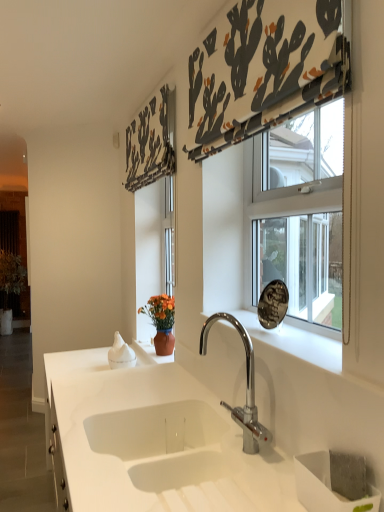
Measure the distance between white marble window sill at center and camera.

1.01 meters.

This screenshot has width=384, height=512. I want to click on white marble window sill at center, so click(296, 341).

Measure the distance between white matte sink at center and camera.

white matte sink at center is 38.37 inches away from camera.

Identify the location of white fabric with cactus print at upper center, which is the first curtain in right-to-left order. (263, 69).

The image size is (384, 512). I want to click on chrome metallic faucet at center, so click(x=246, y=387).

How much distance is there between black fabric with cactus print at upper center, arranged as the second curtain when viewed from the front, and chrome metallic faucet at center?

black fabric with cactus print at upper center, arranged as the second curtain when viewed from the front, and chrome metallic faucet at center are 3.62 feet apart from each other.

Looking at this image, is black fabric with cactus print at upper center, which ranks as the first curtain in left-to-right order, inside the boundaries of chrome metallic faucet at center, or outside?

black fabric with cactus print at upper center, which ranks as the first curtain in left-to-right order, cannot be found inside chrome metallic faucet at center.

Find the location of a particular element. tap that appears below the black fabric with cactus print at upper center, arranged as the 1th curtain when viewed from the back (from the image's perspective) is located at coordinates (246, 387).

Is black fabric with cactus print at upper center, arranged as the second curtain when viewed from the front, aimed at chrome metallic faucet at center?

No.

Is black fabric with cactus print at upper center, the second curtain viewed from the right, positioned far away from white fabric with cactus print at upper center, the first curtain when ordered from front to back?

No, black fabric with cactus print at upper center, the second curtain viewed from the right, is not far away from white fabric with cactus print at upper center, the first curtain when ordered from front to back.

Looking at this image, is black fabric with cactus print at upper center, arranged as the second curtain when viewed from the front, looking in the opposite direction of white fabric with cactus print at upper center, which is the first curtain in right-to-left order?

No, white fabric with cactus print at upper center, which is the first curtain in right-to-left order, is not at the back of black fabric with cactus print at upper center, arranged as the second curtain when viewed from the front.

Locate an element on the screen. curtain above the black fabric with cactus print at upper center, which ranks as the first curtain in left-to-right order (from a real-world perspective) is located at coordinates (263, 69).

Is white fabric with cactus print at upper center, the second curtain in the left-to-right sequence, inside black fabric with cactus print at upper center, the second curtain viewed from the right?

Definitely not — white fabric with cactus print at upper center, the second curtain in the left-to-right sequence, is not inside black fabric with cactus print at upper center, the second curtain viewed from the right.

Which object is more forward, white fabric with cactus print at upper center, which is counted as the 2th curtain, starting from the back, or black fabric with cactus print at upper center, which ranks as the first curtain in left-to-right order?

white fabric with cactus print at upper center, which is counted as the 2th curtain, starting from the back, is closer to the camera.

Visually, is white fabric with cactus print at upper center, the first curtain when ordered from front to back, positioned to the left or to the right of black fabric with cactus print at upper center, which ranks as the first curtain in left-to-right order?

white fabric with cactus print at upper center, the first curtain when ordered from front to back, is to the right of black fabric with cactus print at upper center, which ranks as the first curtain in left-to-right order.

Considering the sizes of white fabric with cactus print at upper center, which is counted as the 2th curtain, starting from the back, and black fabric with cactus print at upper center, the second curtain viewed from the right, in the image, is white fabric with cactus print at upper center, which is counted as the 2th curtain, starting from the back, taller or shorter than black fabric with cactus print at upper center, the second curtain viewed from the right,?

Considering their sizes, white fabric with cactus print at upper center, which is counted as the 2th curtain, starting from the back, has more height than black fabric with cactus print at upper center, the second curtain viewed from the right.

Is white fabric with cactus print at upper center, which is counted as the 2th curtain, starting from the back, in contact with black fabric with cactus print at upper center, arranged as the second curtain when viewed from the front?

No, white fabric with cactus print at upper center, which is counted as the 2th curtain, starting from the back, is not making contact with black fabric with cactus print at upper center, arranged as the second curtain when viewed from the front.

Could you tell me if black fabric with cactus print at upper center, arranged as the 1th curtain when viewed from the back, is turned towards white matte sink at center?

No, black fabric with cactus print at upper center, arranged as the 1th curtain when viewed from the back, is not facing towards white matte sink at center.

Is black fabric with cactus print at upper center, which ranks as the first curtain in left-to-right order, positioned far away from white matte sink at center?

black fabric with cactus print at upper center, which ranks as the first curtain in left-to-right order, is far away from white matte sink at center.

Which point is more forward, (161, 95) or (149, 432)?

The point (149, 432) is closer to the camera.

Is black fabric with cactus print at upper center, arranged as the 1th curtain when viewed from the back, smaller than white matte sink at center?

Yes.

Which is behind, white fabric with cactus print at upper center, the first curtain when ordered from front to back, or chrome metallic faucet at center?

Positioned behind is chrome metallic faucet at center.

Which of these two, white fabric with cactus print at upper center, the first curtain when ordered from front to back, or chrome metallic faucet at center, is thinner?

white fabric with cactus print at upper center, the first curtain when ordered from front to back, is thinner.

From a real-world perspective, is white fabric with cactus print at upper center, which is counted as the 2th curtain, starting from the back, located beneath chrome metallic faucet at center?

No.

How different are the orientations of white fabric with cactus print at upper center, the second curtain in the left-to-right sequence, and white matte sink at center in degrees?

The facing directions of white fabric with cactus print at upper center, the second curtain in the left-to-right sequence, and white matte sink at center are 1.97 degrees apart.

Considering the relative sizes of white fabric with cactus print at upper center, the first curtain when ordered from front to back, and white matte sink at center in the image provided, is white fabric with cactus print at upper center, the first curtain when ordered from front to back, smaller than white matte sink at center?

Yes, white fabric with cactus print at upper center, the first curtain when ordered from front to back, is smaller than white matte sink at center.

Is point (302, 11) in front of point (154, 451)?

Yes.

Does white fabric with cactus print at upper center, which is counted as the 2th curtain, starting from the back, appear on the left side of white matte sink at center?

In fact, white fabric with cactus print at upper center, which is counted as the 2th curtain, starting from the back, is to the right of white matte sink at center.

Is chrome metallic faucet at center completely or partially outside of wooden screen door at left?

Yes, chrome metallic faucet at center is located beyond the bounds of wooden screen door at left.

Is point (245, 436) positioned behind point (20, 204)?

No, it is in front of (20, 204).

Is chrome metallic faucet at center at the right side of wooden screen door at left?

Indeed, chrome metallic faucet at center is positioned on the right side of wooden screen door at left.

You are a GUI agent. You are given a task and a screenshot of the screen. Output one action in this format:
    pyautogui.click(x=<x>, y=<y>)
    Task: Click on the 1st curtain directly above the chrome metallic faucet at center (from a real-world perspective)
    This screenshot has width=384, height=512.
    Given the screenshot: What is the action you would take?
    pyautogui.click(x=151, y=142)

Find the location of `curtain in front of the black fabric with cactus print at upper center, the second curtain viewed from the right`. curtain in front of the black fabric with cactus print at upper center, the second curtain viewed from the right is located at coordinates (263, 69).

Looking at the image, which one is located further to wooden screen door at left, white fabric with cactus print at upper center, the second curtain in the left-to-right sequence, or chrome metallic faucet at center?

Based on the image, chrome metallic faucet at center appears to be further to wooden screen door at left.

Considering their positions, is wooden screen door at left positioned further to chrome metallic faucet at center than black fabric with cactus print at upper center, the second curtain viewed from the right?

wooden screen door at left is further to chrome metallic faucet at center.

Based on their spatial positions, is white matte sink at center or chrome metallic faucet at center further from white fabric with cactus print at upper center, which is counted as the 2th curtain, starting from the back?

Based on the image, white matte sink at center appears to be further to white fabric with cactus print at upper center, which is counted as the 2th curtain, starting from the back.

From the image, which object appears to be nearer to white matte sink at center, chrome metallic faucet at center or black fabric with cactus print at upper center, the second curtain viewed from the right?

chrome metallic faucet at center.

Estimate the real-world distances between objects in this image. Which object is further from chrome metallic faucet at center, white marble window sill at center or white matte sink at center?

The object further to chrome metallic faucet at center is white matte sink at center.

Estimate the real-world distances between objects in this image. Which object is closer to white fabric with cactus print at upper center, the second curtain in the left-to-right sequence, wooden screen door at left or chrome metallic faucet at center?

chrome metallic faucet at center is positioned closer to the anchor white fabric with cactus print at upper center, the second curtain in the left-to-right sequence.

Based on their spatial positions, is white fabric with cactus print at upper center, which is counted as the 2th curtain, starting from the back, or wooden screen door at left further from black fabric with cactus print at upper center, arranged as the 1th curtain when viewed from the back?

Based on the image, wooden screen door at left appears to be further to black fabric with cactus print at upper center, arranged as the 1th curtain when viewed from the back.

When comparing their distances from chrome metallic faucet at center, does white fabric with cactus print at upper center, which is counted as the 2th curtain, starting from the back, or white marble window sill at center seem further?

white fabric with cactus print at upper center, which is counted as the 2th curtain, starting from the back, is positioned further to the anchor chrome metallic faucet at center.

Locate an element on the screen. The height and width of the screenshot is (512, 384). tap between white marble window sill at center and wooden screen door at left in the front-back direction is located at coordinates (246, 387).

Where is `window sill positioned between white fabric with cactus print at upper center, the first curtain when ordered from front to back, and black fabric with cactus print at upper center, the second curtain viewed from the right, from near to far`? window sill positioned between white fabric with cactus print at upper center, the first curtain when ordered from front to back, and black fabric with cactus print at upper center, the second curtain viewed from the right, from near to far is located at coordinates (296, 341).

The image size is (384, 512). I want to click on tap that lies between black fabric with cactus print at upper center, the second curtain viewed from the right, and white matte sink at center from top to bottom, so click(x=246, y=387).

Locate an element on the screen. window sill between white fabric with cactus print at upper center, the first curtain when ordered from front to back, and chrome metallic faucet at center from top to bottom is located at coordinates (296, 341).